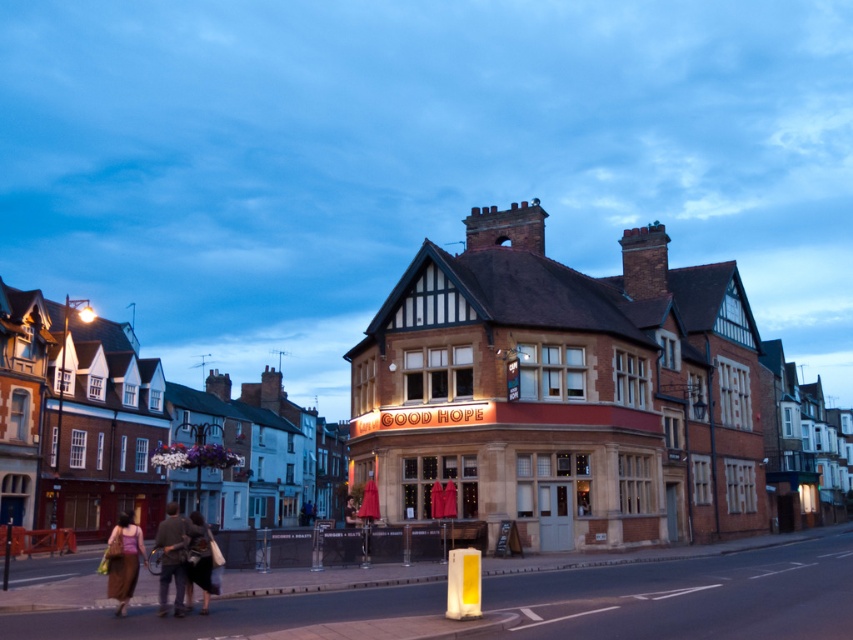
Question: Which of the following is the farthest from the observer?

Choices:
 (A) brown leather jacket at lower left
 (B) brown textured dress at lower left

Answer: (B)

Question: Can you confirm if brown leather jacket at lower left is positioned below brown textured dress at lower left?

Choices:
 (A) no
 (B) yes

Answer: (A)

Question: Is brown leather jacket at lower left positioned behind brown textured dress at lower left?

Choices:
 (A) no
 (B) yes

Answer: (A)

Question: From the image, what is the correct spatial relationship of brown leather jacket at lower left in relation to brown textured dress at lower left?

Choices:
 (A) below
 (B) above

Answer: (B)

Question: Which point is closer to the camera taking this photo?

Choices:
 (A) (183, 531)
 (B) (113, 572)

Answer: (B)